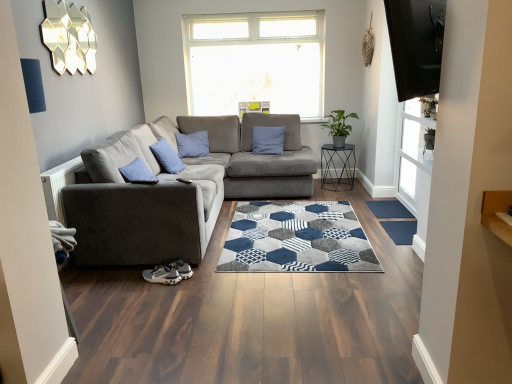
Question: Is blue textured mat at lower right oriented towards blue cotton pillow at center?

Choices:
 (A) no
 (B) yes

Answer: (A)

Question: Does blue textured mat at lower right have a greater height compared to blue cotton pillow at center?

Choices:
 (A) yes
 (B) no

Answer: (B)

Question: Considering the relative positions of blue textured mat at lower right and blue cotton pillow at center in the image provided, is blue textured mat at lower right to the right of blue cotton pillow at center from the viewer's perspective?

Choices:
 (A) no
 (B) yes

Answer: (B)

Question: Does blue textured mat at lower right have a larger size compared to blue cotton pillow at center?

Choices:
 (A) no
 (B) yes

Answer: (A)

Question: From a real-world perspective, is blue textured mat at lower right physically below blue cotton pillow at center?

Choices:
 (A) no
 (B) yes

Answer: (B)

Question: In the image, is metallic black side table at center-right positioned in front of or behind suede gray couch at left?

Choices:
 (A) front
 (B) behind

Answer: (B)

Question: Visually, is metallic black side table at center-right positioned to the left or to the right of suede gray couch at left?

Choices:
 (A) right
 (B) left

Answer: (A)

Question: From the image's perspective, is metallic black side table at center-right located above or below suede gray couch at left?

Choices:
 (A) above
 (B) below

Answer: (A)

Question: Considering the positions of point tap(344, 185) and point tap(302, 160), is point tap(344, 185) closer or farther from the camera than point tap(302, 160)?

Choices:
 (A) farther
 (B) closer

Answer: (A)

Question: Is point (400, 203) positioned closer to the camera than point (399, 240)?

Choices:
 (A) farther
 (B) closer

Answer: (A)

Question: From the image's perspective, is blue textured mat at lower right positioned above or below dark blue textured mat at lower right?

Choices:
 (A) above
 (B) below

Answer: (A)

Question: Looking at the image, does blue textured mat at lower right seem bigger or smaller compared to dark blue textured mat at lower right?

Choices:
 (A) big
 (B) small

Answer: (B)

Question: Is blue textured mat at lower right wider or thinner than dark blue textured mat at lower right?

Choices:
 (A) thin
 (B) wide

Answer: (A)

Question: Is suede gray couch at left inside the boundaries of dark blue textured mat at lower right, or outside?

Choices:
 (A) inside
 (B) outside

Answer: (B)

Question: In terms of width, does suede gray couch at left look wider or thinner when compared to dark blue textured mat at lower right?

Choices:
 (A) thin
 (B) wide

Answer: (B)